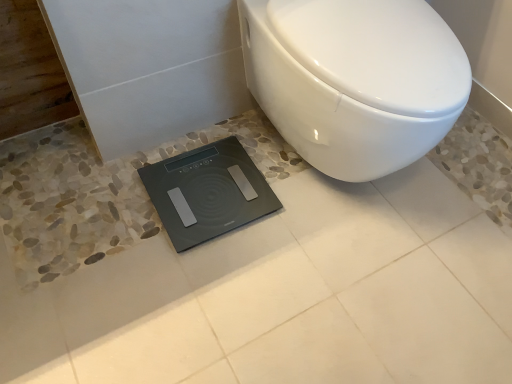
Identify the location of vacant area that lies between white glossy toilet at center and black glass scale at lower center. (262, 233).